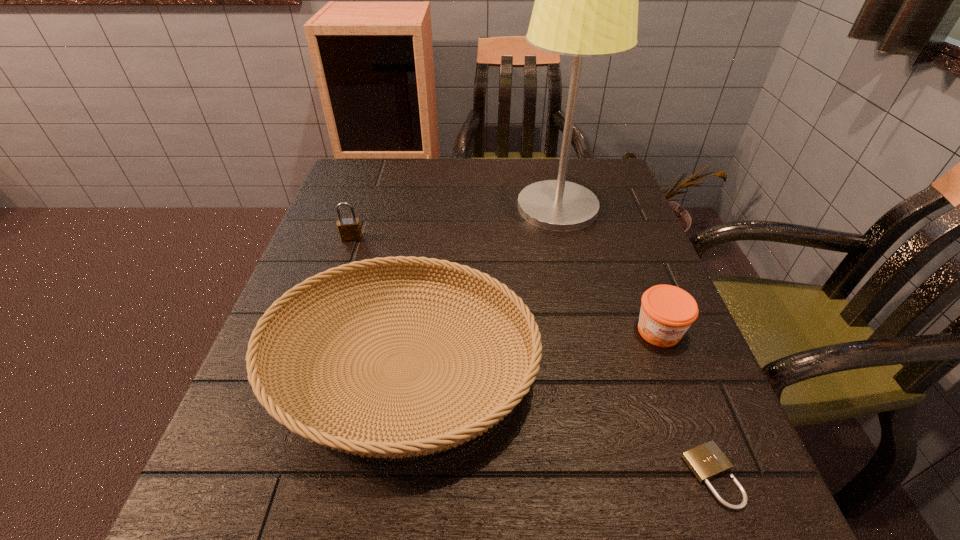
The image size is (960, 540). I want to click on vacant area located on the back of the basket, so click(x=429, y=193).

Locate an element on the screen. This screenshot has height=540, width=960. free point located 0.180m on the front label of the second shortest object is located at coordinates (705, 451).

Where is `free space located 0.240m on the left of the shortest object`? This screenshot has width=960, height=540. free space located 0.240m on the left of the shortest object is located at coordinates (516, 476).

This screenshot has width=960, height=540. I want to click on object that is at the far edge, so click(586, 0).

Locate an element on the screen. object at the near edge is located at coordinates (706, 461).

Find the location of a particular element. Image resolution: width=960 pixels, height=540 pixels. padlock situated at the left edge is located at coordinates (349, 228).

Find the location of a particular element. The image size is (960, 540). basket situated at the left edge is located at coordinates (262, 380).

Where is `table lamp that is positioned at the right edge`? The image size is (960, 540). table lamp that is positioned at the right edge is located at coordinates (586, 0).

Image resolution: width=960 pixels, height=540 pixels. Find the location of `jam that is at the right edge`. jam that is at the right edge is located at coordinates (667, 311).

I want to click on padlock situated at the right edge, so click(x=706, y=461).